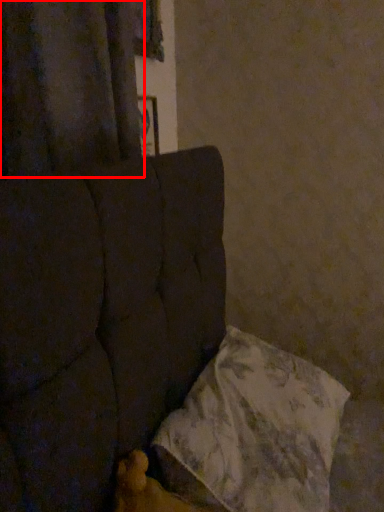
Question: Where is curtain (annotated by the red box) located in relation to pillow in the image?

Choices:
 (A) left
 (B) right

Answer: (A)